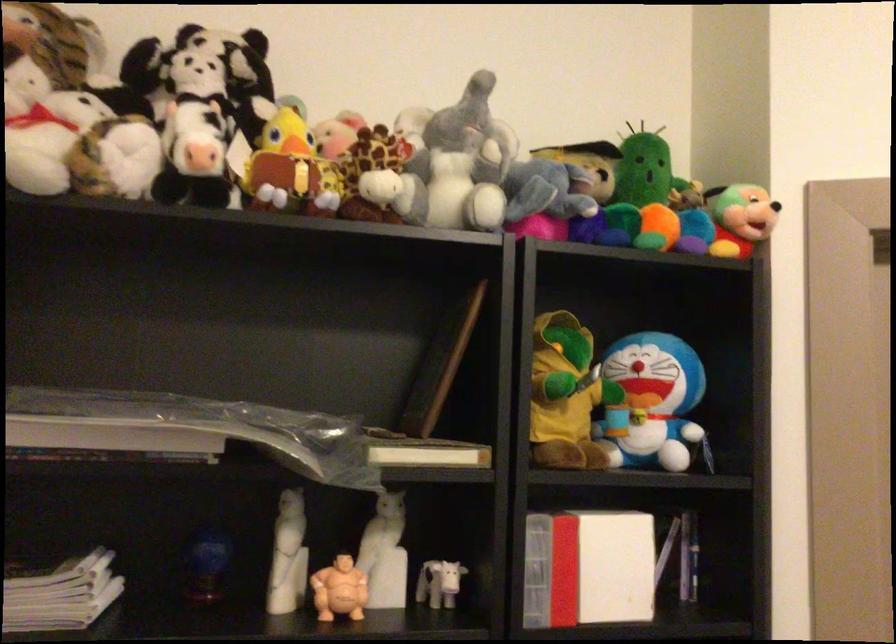
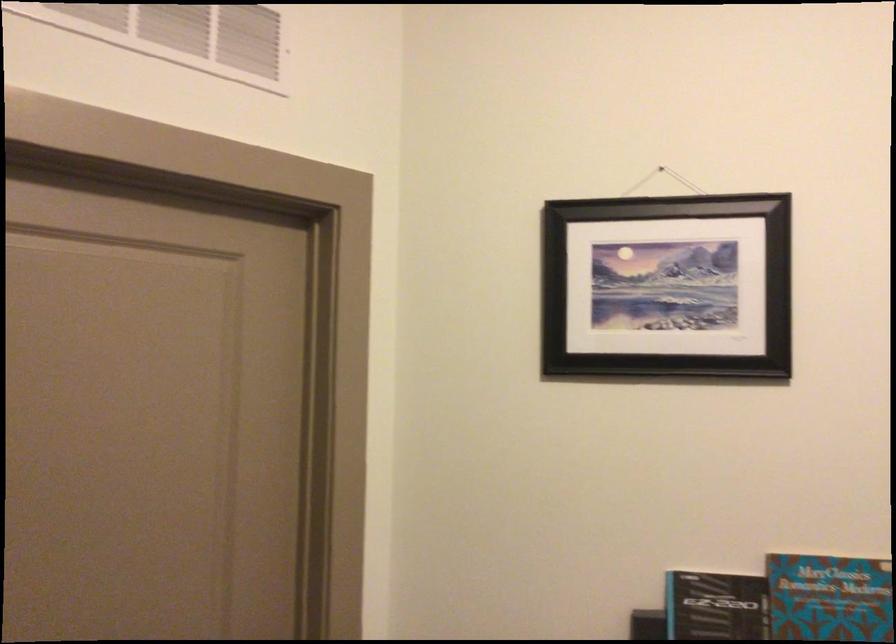
Question: How did the camera likely rotate?

Choices:
 (A) Left
 (B) Right
 (C) Up
 (D) Down

Answer: (B)